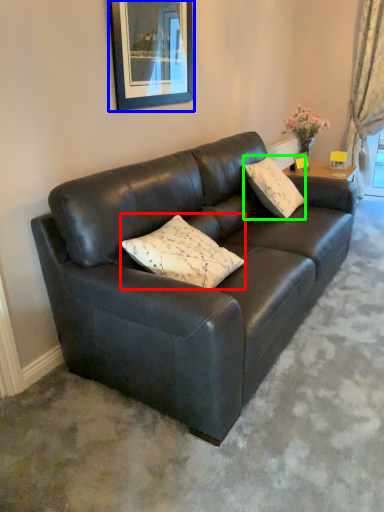
Question: Considering the real-world distances, which object is closest to pillow (highlighted by a red box)? picture frame (highlighted by a blue box) or pillow (highlighted by a green box).

Choices:
 (A) picture frame
 (B) pillow

Answer: (A)